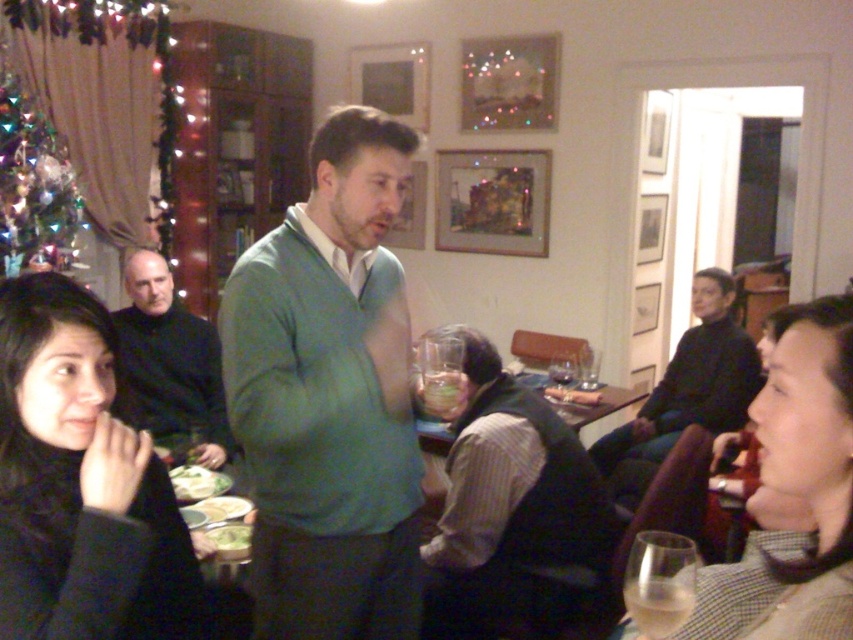
Question: Which point is closer to the camera?

Choices:
 (A) checkered fabric scarf at lower right
 (B) green leafy salad at lower left
 (C) black woolen sweater at lower left
 (D) green sweater at center

Answer: (A)

Question: Which point appears farthest from the camera in this image?

Choices:
 (A) (589, 420)
 (B) (157, 612)

Answer: (A)

Question: Which point is farther from the camera taking this photo?

Choices:
 (A) tap(728, 333)
 (B) tap(397, 467)

Answer: (A)

Question: Does green leafy salad at lower left appear under green leafy vegetable at lower left?

Choices:
 (A) yes
 (B) no

Answer: (B)

Question: Where is black woolen sweater at lower left located in relation to yellow matte bowl at center in the image?

Choices:
 (A) below
 (B) above

Answer: (A)

Question: Can you confirm if green leafy salad at lower left is thinner than yellow matte bowl at center?

Choices:
 (A) yes
 (B) no

Answer: (B)